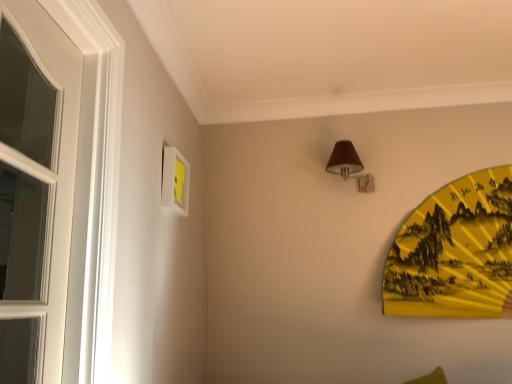
Question: Would you say brown fabric lampshade at upper center is to the left or to the right of yellow paper fan at right in the picture?

Choices:
 (A) right
 (B) left

Answer: (B)

Question: In terms of height, does brown fabric lampshade at upper center look taller or shorter compared to yellow paper fan at right?

Choices:
 (A) short
 (B) tall

Answer: (A)

Question: Which of these objects is positioned closest to the white matte picture frame at upper left?

Choices:
 (A) brown fabric lampshade at upper center
 (B) yellow paper fan at right

Answer: (A)

Question: Based on their relative distances, which object is farther from the white matte picture frame at upper left?

Choices:
 (A) brown fabric lampshade at upper center
 (B) yellow paper fan at right

Answer: (B)